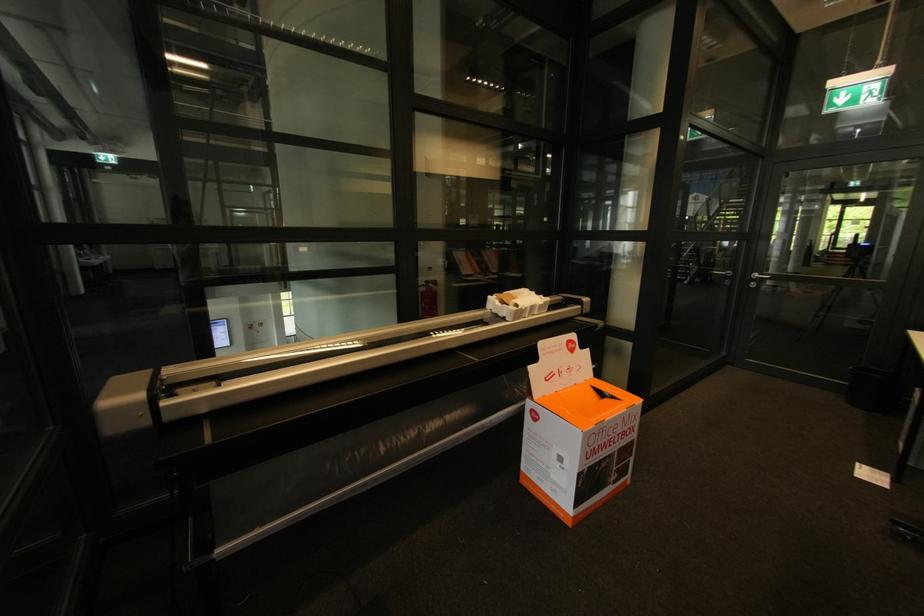
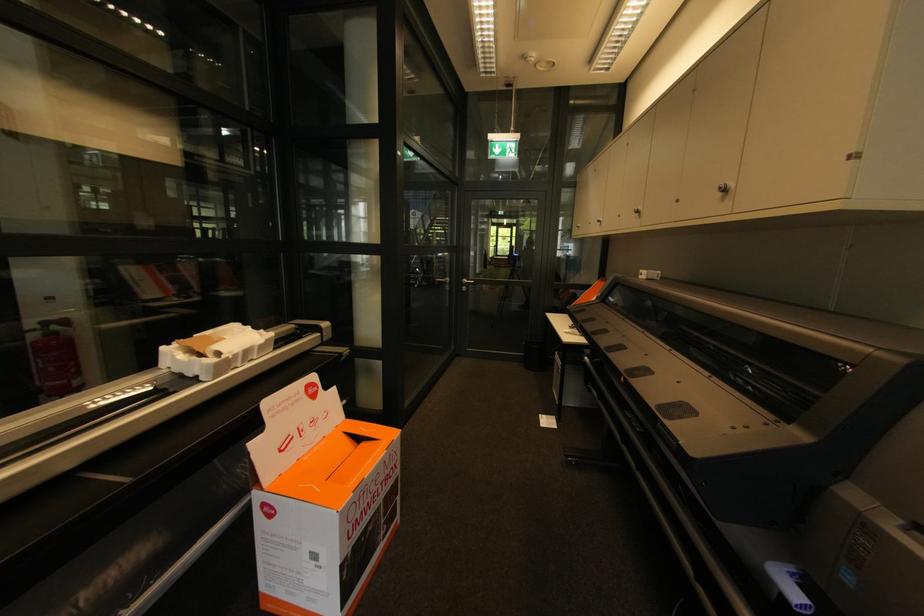
Locate, in the second image, the point that corresponds to pixel 553 450 in the first image.

(299, 549)